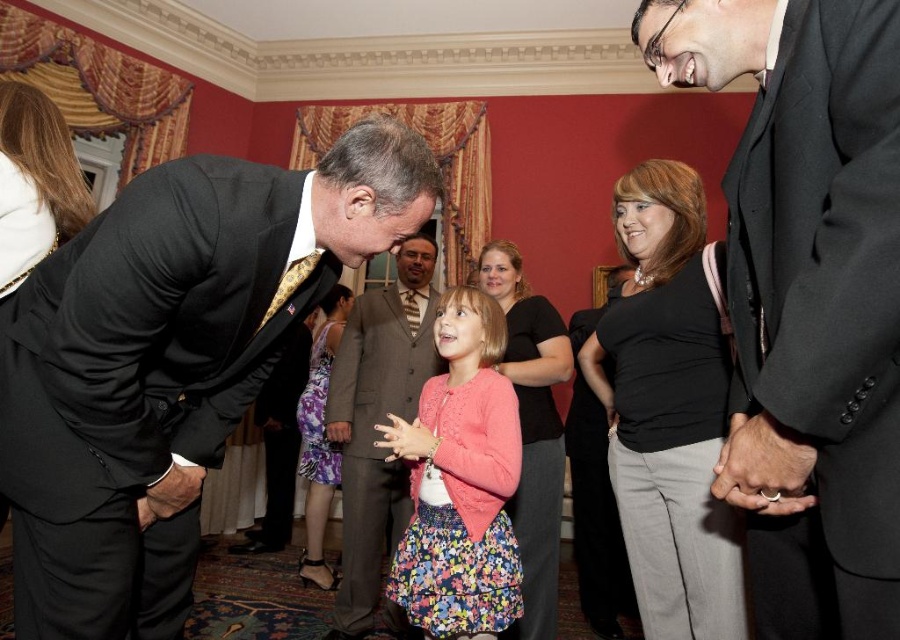
Question: Which of the following is the farthest from the observer?

Choices:
 (A) (320, 470)
 (B) (356, 464)
 (C) (833, 630)

Answer: (A)

Question: Is black suit at center further to the viewer compared to black satin suit at left?

Choices:
 (A) no
 (B) yes

Answer: (A)

Question: Considering the relative positions of black suit at center and black satin suit at left in the image provided, where is black suit at center located with respect to black satin suit at left?

Choices:
 (A) left
 (B) right

Answer: (B)

Question: Considering the relative positions of black suit at center and matte brown suit at center in the image provided, where is black suit at center located with respect to matte brown suit at center?

Choices:
 (A) above
 (B) below

Answer: (A)

Question: Estimate the real-world distances between objects in this image. Which object is closer to the matte brown suit at center?

Choices:
 (A) black satin suit at left
 (B) floral fabric dress at center
 (C) black suit at center
 (D) pink fabric dress at center

Answer: (D)

Question: Which object is closer to the camera taking this photo?

Choices:
 (A) black satin suit at left
 (B) black suit at center
 (C) matte brown suit at center
 (D) pink fabric dress at center

Answer: (B)